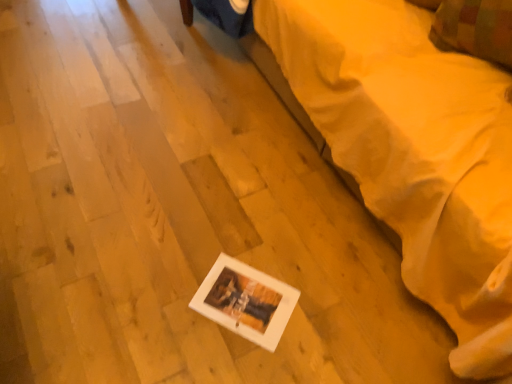
Question: From a real-world perspective, relative to white matte picture frame at lower center, is plaid fabric pillow at upper right vertically above or below?

Choices:
 (A) below
 (B) above

Answer: (B)

Question: Based on their positions, is plaid fabric pillow at upper right located to the left or right of white matte picture frame at lower center?

Choices:
 (A) right
 (B) left

Answer: (A)

Question: In terms of size, does plaid fabric pillow at upper right appear bigger or smaller than white matte picture frame at lower center?

Choices:
 (A) small
 (B) big

Answer: (A)

Question: Does point (388, 190) appear closer or farther from the camera than point (495, 6)?

Choices:
 (A) closer
 (B) farther

Answer: (A)

Question: From a real-world perspective, is white matte picture frame at lower center above or below plaid fabric pillow at upper right?

Choices:
 (A) above
 (B) below

Answer: (B)

Question: Is white matte picture frame at lower center bigger or smaller than plaid fabric pillow at upper right?

Choices:
 (A) big
 (B) small

Answer: (A)

Question: In terms of width, does white matte picture frame at lower center look wider or thinner when compared to plaid fabric pillow at upper right?

Choices:
 (A) wide
 (B) thin

Answer: (A)